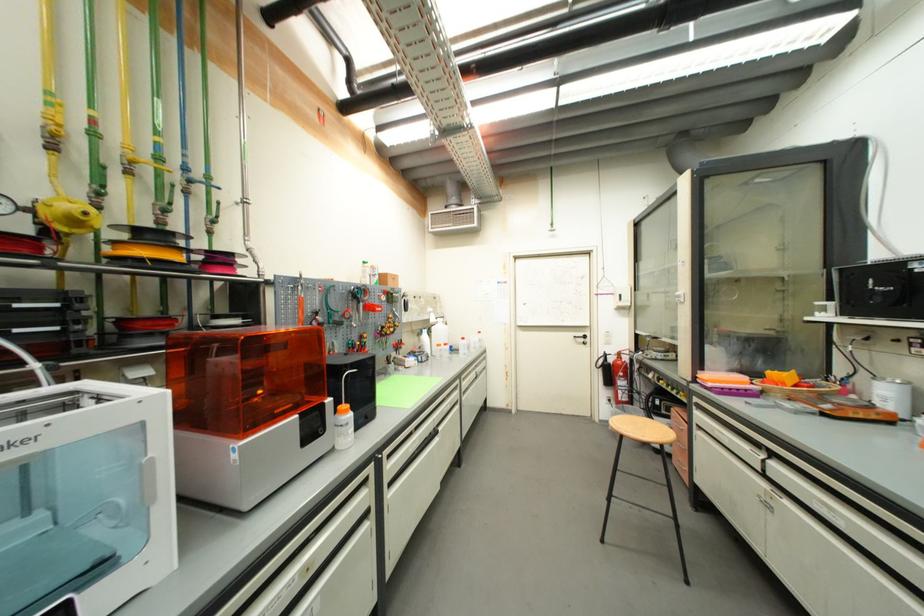
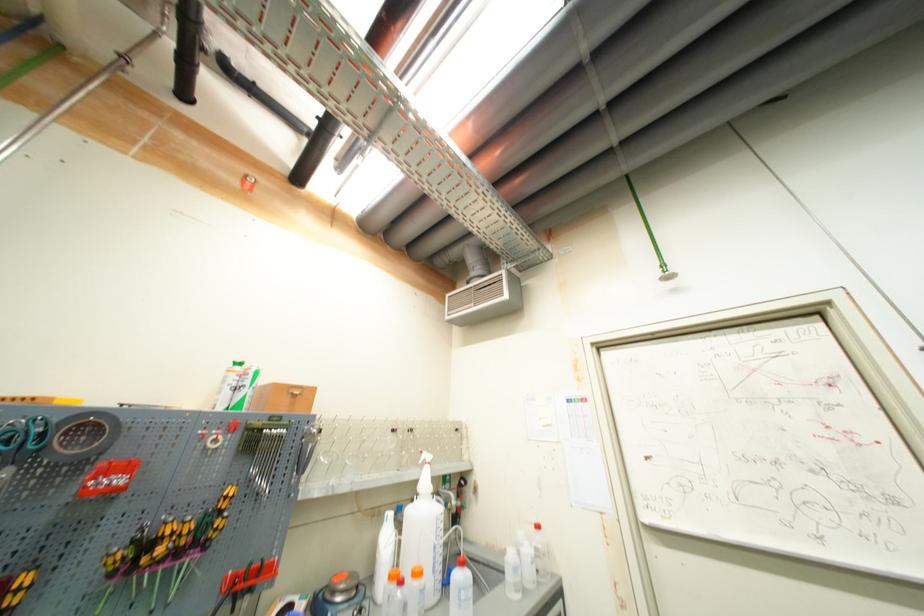
The point at (327,120) is marked in the first image. Where is the corresponding point in the second image?

(253, 185)